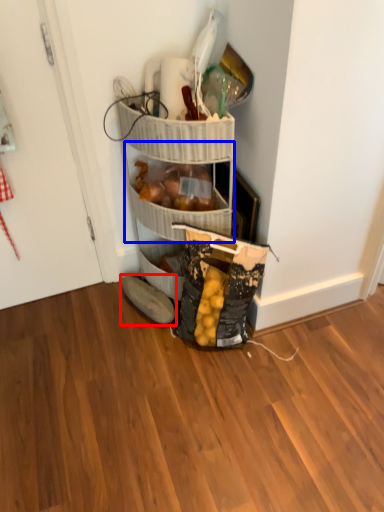
Question: Which object appears closest to the camera in this image, footwear (highlighted by a red box) or basket (highlighted by a blue box)?

Choices:
 (A) footwear
 (B) basket

Answer: (B)